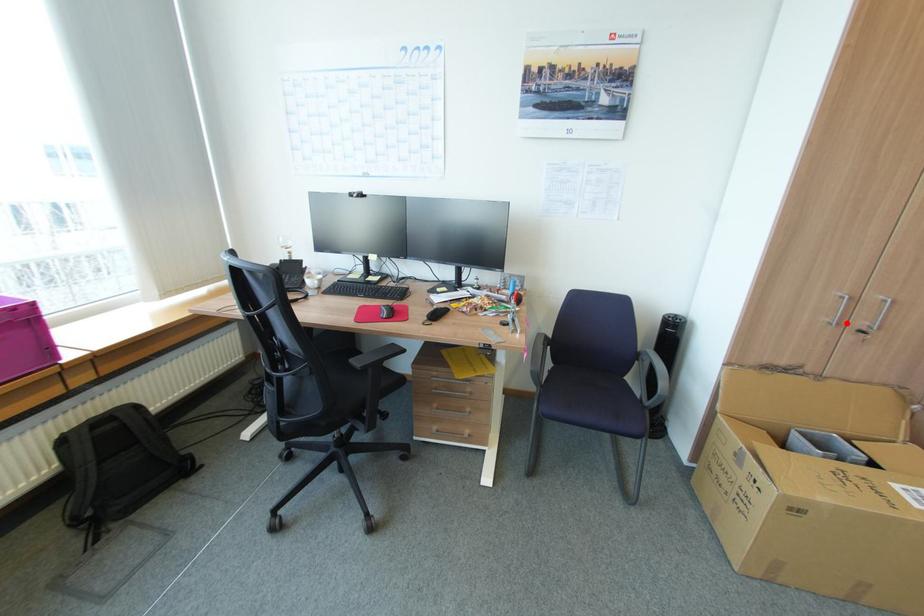
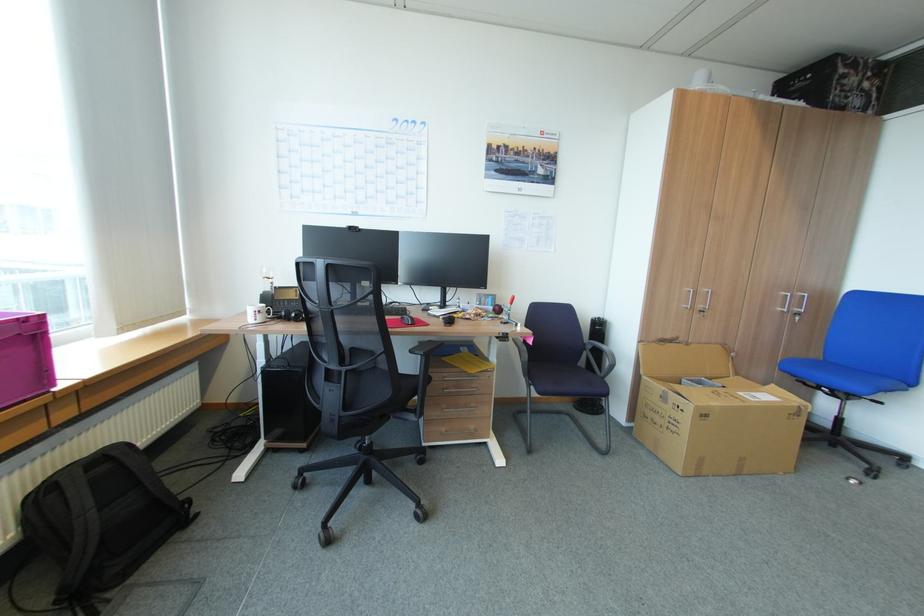
Question: I am providing you with two images of the same scene from different viewpoints. A red point is marked on the first image. Can you still see the location of the red point in image 2?

Choices:
 (A) Yes
 (B) No

Answer: (A)